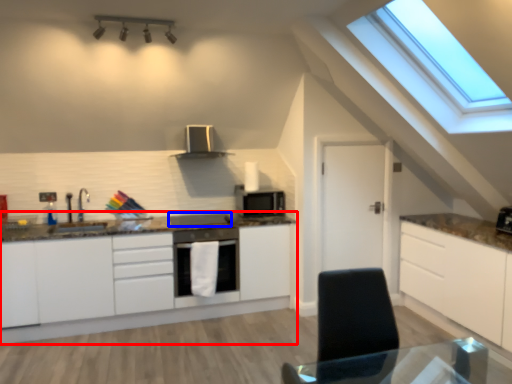
Question: Which of the following is the closest to the observer, cabinetry (highlighted by a red box) or appliance (highlighted by a blue box)?

Choices:
 (A) cabinetry
 (B) appliance

Answer: (A)